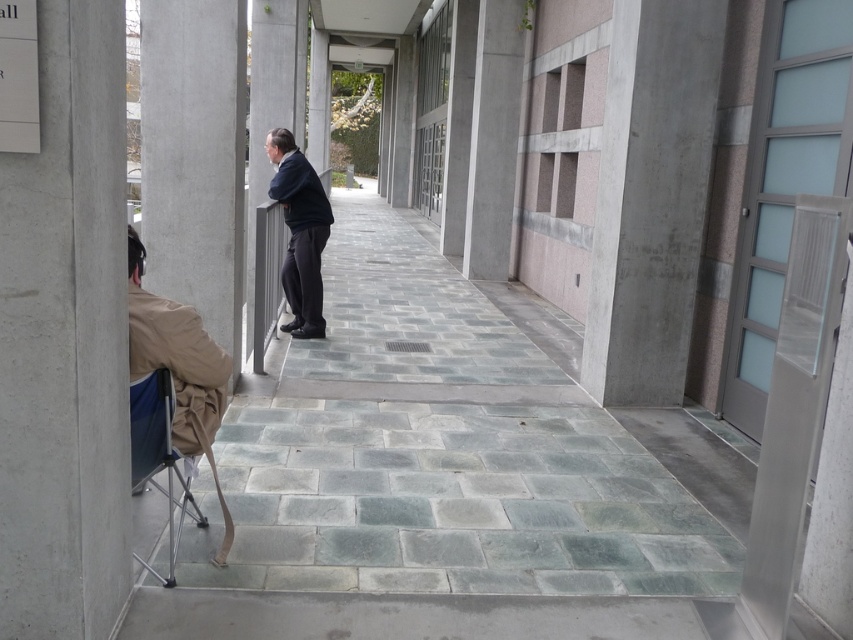
Describe the element at coordinates (194, 156) in the screenshot. I see `gray concrete pillar at left` at that location.

Is gray concrete pillar at left bigger than dark blue jacket at center?

Yes, gray concrete pillar at left is bigger than dark blue jacket at center.

Between point (218, 275) and point (310, 264), which one is positioned behind?

Point (310, 264)

At what (x,y) coordinates should I click in order to perform the action: click on gray concrete pillar at left. Please return your answer as a coordinate pair (x, y). Looking at the image, I should click on (194, 156).

Is dark blue jacket at center to the right of blue fabric folding chair at lower left from the viewer's perspective?

No, dark blue jacket at center is not to the right of blue fabric folding chair at lower left.

Which is more to the left, dark blue jacket at center or blue fabric folding chair at lower left?

dark blue jacket at center is more to the left.

Does point (300, 225) lie in front of point (149, 566)?

No.

The image size is (853, 640). I want to click on dark blue jacket at center, so click(299, 232).

Based on the photo, which is more to the left, tan fabric chair at lower left or dark blue jacket at center?

Positioned to the left is dark blue jacket at center.

Who is more distant from viewer, [146,310] or [303,262]?

The point [303,262] is more distant.

Locate an element on the screen. The image size is (853, 640). tan fabric chair at lower left is located at coordinates (177, 356).